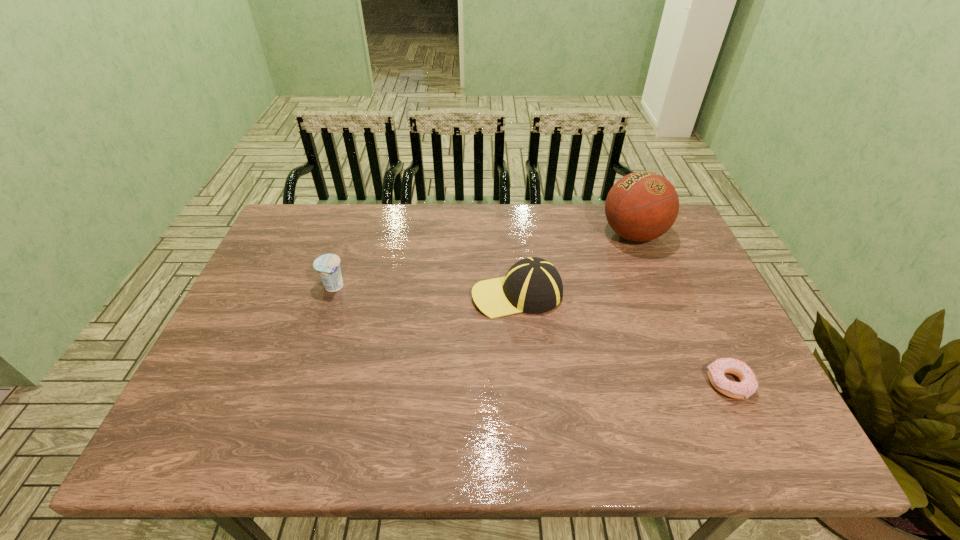
Image resolution: width=960 pixels, height=540 pixels. In order to click on free area in between the second tallest object and the tallest object in this screenshot , I will do `click(575, 264)`.

The image size is (960, 540). Find the location of `vacant area between the tallest object and the doughnut`. vacant area between the tallest object and the doughnut is located at coordinates (682, 309).

Where is `vacant space that's between the tallest object and the third object from right to left`? The width and height of the screenshot is (960, 540). vacant space that's between the tallest object and the third object from right to left is located at coordinates (575, 264).

Identify the location of unoccupied area between the tallest object and the third tallest object. The height and width of the screenshot is (540, 960). tap(484, 260).

You are a GUI agent. You are given a task and a screenshot of the screen. Output one action in this format:
    pyautogui.click(x=<x>, y=<y>)
    Task: Click on the empty location between the tallest object and the second object from left to right
    
    Given the screenshot: What is the action you would take?
    pyautogui.click(x=575, y=264)

Where is `the third closest object to the second shortest object`? The height and width of the screenshot is (540, 960). the third closest object to the second shortest object is located at coordinates click(x=748, y=384).

Locate an element on the screen. This screenshot has height=540, width=960. object that ranks as the second closest to the baseball cap is located at coordinates (748, 384).

Identify the location of free space that satisfies the following two spatial constraints: 1. on the front side of the basketball; 2. with the brim of the baseball cap facing forward. The width and height of the screenshot is (960, 540). (657, 294).

Find the location of `vacant space that satisfies the following two spatial constraints: 1. with the brim of the shortest object facing forward; 2. on the left side of the second object from left to right`. vacant space that satisfies the following two spatial constraints: 1. with the brim of the shortest object facing forward; 2. on the left side of the second object from left to right is located at coordinates (525, 383).

The image size is (960, 540). I want to click on free space that satisfies the following two spatial constraints: 1. with the brim of the third object from right to left facing forward; 2. on the left side of the doughnut, so click(525, 383).